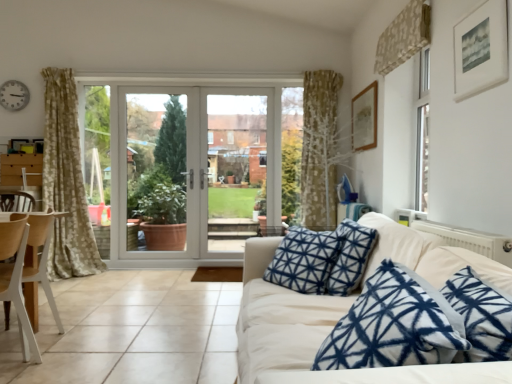
What do you see at coordinates (132, 331) in the screenshot? I see `white tile at lower left` at bounding box center [132, 331].

The image size is (512, 384). What do you see at coordinates (302, 331) in the screenshot?
I see `white fabric couch at center` at bounding box center [302, 331].

The image size is (512, 384). What are the coordinates of `clear glass door at center` in the screenshot? It's located at (238, 166).

This screenshot has width=512, height=384. What do you see at coordinates (197, 168) in the screenshot? I see `white glossy door at center` at bounding box center [197, 168].

Locate an element on the screen. This screenshot has height=384, width=512. white tile at lower left is located at coordinates tap(132, 331).

Does white fabric couch at center appear on the right side of beige textured curtain at upper right?

No.

From the picture: Is white fabric couch at center far from beige textured curtain at upper right?

white fabric couch at center is positioned a significant distance from beige textured curtain at upper right.

Which object is closer to the camera, white fabric couch at center or beige textured curtain at upper right?

white fabric couch at center is closer to the camera.

From a real-world perspective, which is physically below, white plastic clock at upper left or white glossy door at center?

white glossy door at center.

Between white plastic clock at upper left and white glossy door at center, which one has smaller size?

With smaller size is white plastic clock at upper left.

Between white plastic clock at upper left and white glossy door at center, which one has more height?

white glossy door at center is taller.

Which of these two, white matte picture frame at upper right, the first picture frame when ordered from front to back, or white fabric couch at center, stands shorter?

With less height is white matte picture frame at upper right, the first picture frame when ordered from front to back.

Considering the sizes of objects white matte picture frame at upper right, the second picture frame positioned from the back, and white fabric couch at center in the image provided, who is bigger, white matte picture frame at upper right, the second picture frame positioned from the back, or white fabric couch at center?

With larger size is white fabric couch at center.

Is white matte picture frame at upper right, the first picture frame when ordered from front to back, not within white fabric couch at center?

Yes, white matte picture frame at upper right, the first picture frame when ordered from front to back, is outside of white fabric couch at center.

Is white matte picture frame at upper right, the second picture frame positioned from the back, with white fabric couch at center?

There is a gap between white matte picture frame at upper right, the second picture frame positioned from the back, and white fabric couch at center.

In the scene shown: Which is in front, beige textured curtain at upper right or white tile at lower left?

white tile at lower left is in front.

Who is taller, beige textured curtain at upper right or white tile at lower left?

With more height is beige textured curtain at upper right.

Is beige textured curtain at upper right spatially inside white tile at lower left, or outside of it?

beige textured curtain at upper right exists outside the volume of white tile at lower left.

Looking at this image, is beige textured curtain at upper right facing towards white tile at lower left?

No, beige textured curtain at upper right is not oriented towards white tile at lower left.

Considering their positions, is white fabric couch at center located in front of or behind white tile at lower left?

white fabric couch at center is positioned closer to the viewer than white tile at lower left.

Is white fabric couch at center facing towards white tile at lower left?

No, white fabric couch at center does not turn towards white tile at lower left.

Considering the sizes of objects white fabric couch at center and white tile at lower left in the image provided, who is taller, white fabric couch at center or white tile at lower left?

With more height is white fabric couch at center.

Does white fabric couch at center have a lesser width compared to white tile at lower left?

Yes.

Does white wood chair at lower left come behind white wood chair at left?

No, it is not.

Is white wood chair at lower left oriented towards white wood chair at left?

No, white wood chair at lower left is not oriented towards white wood chair at left.

I want to click on chair to the left of white wood chair at lower left, so click(x=39, y=264).

How different are the orientations of white wood chair at left and white glass door at center in degrees?

white wood chair at left and white glass door at center are facing 90.2 degrees away from each other.

Is white glass door at center completely or partially inside white wood chair at left?

Actually, white glass door at center is outside white wood chair at left.

Could you tell me if white wood chair at left is facing white glass door at center?

No, white wood chair at left is not turned towards white glass door at center.

The height and width of the screenshot is (384, 512). I want to click on curtain located on the right of white fabric couch at center, so click(403, 37).

Identify the location of door below the white plastic clock at upper left (from the image's perspective). (197, 168).

Which object lies further to the anchor point white tile at lower left, white wood chair at lower left or white matte picture frame at upper right, the first picture frame when ordered from front to back?

The object further to white tile at lower left is white matte picture frame at upper right, the first picture frame when ordered from front to back.

Estimate the real-world distances between objects in this image. Which object is further from white glass door at center, white wood chair at left or white wood chair at lower left?

white wood chair at lower left lies further to white glass door at center than the other object.

Which object lies further to the anchor point white fabric couch at center, clear glass door at center or white plastic clock at upper left?

white plastic clock at upper left.

From the image, which object appears to be nearer to white fabric couch at center, white plastic clock at upper left or white tile at lower left?

The object closer to white fabric couch at center is white tile at lower left.

Considering their positions, is white fabric couch at center positioned further to clear glass door at center than white matte picture frame at upper right, the second picture frame positioned from the back?

white matte picture frame at upper right, the second picture frame positioned from the back, is further to clear glass door at center.

In the scene shown: When comparing their distances from white fabric couch at center, does white wood chair at left or clear glass door at center seem further?

clear glass door at center is positioned further to the anchor white fabric couch at center.

When comparing their distances from white glossy door at center, does white wood chair at lower left or white tile at lower left seem closer?

Among the two, white tile at lower left is located nearer to white glossy door at center.

Based on their spatial positions, is white wood chair at lower left or white fabric couch at center closer to wooden picture frame at upper right, placed as the first picture frame when sorted from back to front?

white fabric couch at center.

You are a GUI agent. You are given a task and a screenshot of the screen. Output one action in this format:
    pyautogui.click(x=<x>, y=<y>)
    Task: Click on the studio couch situated between white tile at lower left and white matte picture frame at upper right, the first picture frame when ordered from front to back, from left to right
    Image resolution: width=512 pixels, height=384 pixels.
    Given the screenshot: What is the action you would take?
    pyautogui.click(x=302, y=331)

The width and height of the screenshot is (512, 384). What are the coordinates of `tile positioned between white matte picture frame at upper right, the first picture frame when ordered from front to back, and white glossy door at center from near to far` in the screenshot? It's located at (132, 331).

Where is `clock located between white tile at lower left and clear glass door at center in the depth direction`? The height and width of the screenshot is (384, 512). clock located between white tile at lower left and clear glass door at center in the depth direction is located at coordinates (14, 95).

Identify the location of curtain between white tile at lower left and white matte picture frame at upper right, the second picture frame positioned from the back. This screenshot has height=384, width=512. (403, 37).